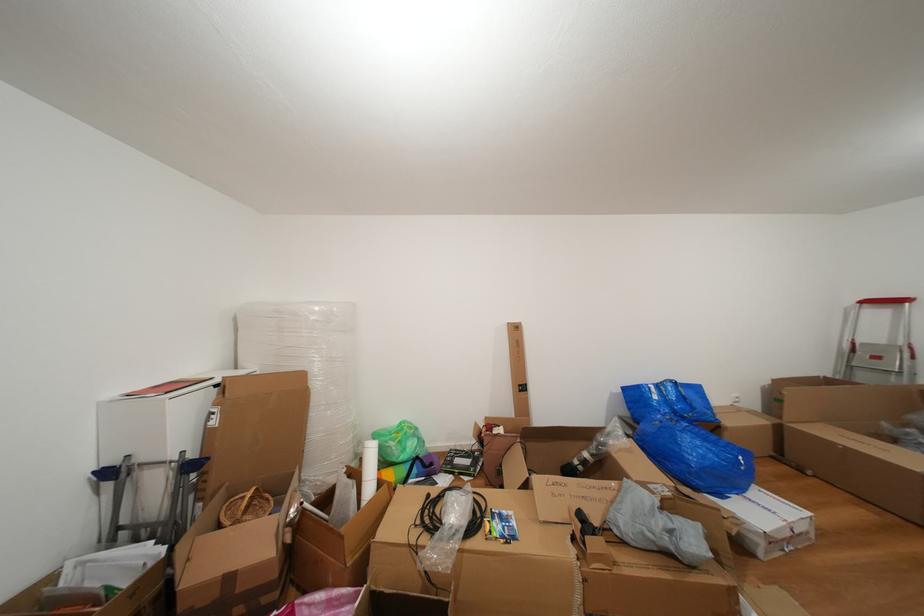
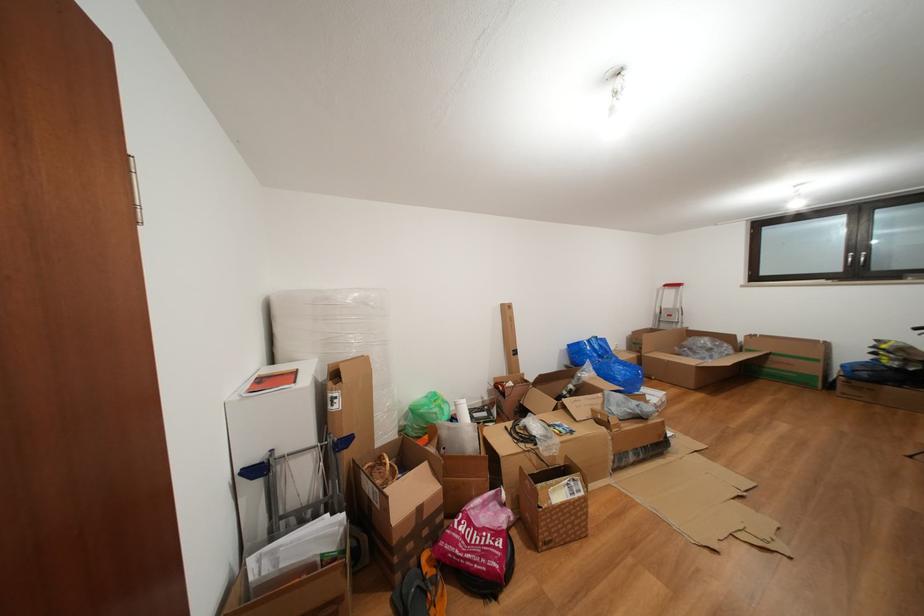
In the second image, find the point that corresponds to (665,391) in the first image.

(597, 346)